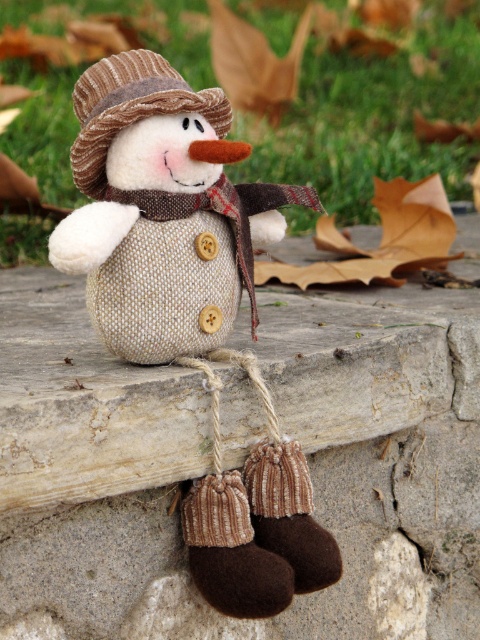
Question: Which point is closer to the camera taking this photo?

Choices:
 (A) (144, 81)
 (B) (462, 504)

Answer: (A)

Question: Which object is positioned closest to the burlap fabric snowman at center?

Choices:
 (A) burlap snowman at center
 (B) brown textured hat at center

Answer: (A)

Question: Which point is closer to the camera?

Choices:
 (A) (136, 113)
 (B) (349, 388)

Answer: (A)

Question: Does burlap fabric snowman at center appear under brown textured hat at center?

Choices:
 (A) no
 (B) yes

Answer: (B)

Question: From the image, what is the correct spatial relationship of burlap fabric snowman at center in relation to burlap snowman at center?

Choices:
 (A) below
 (B) above

Answer: (B)

Question: Is burlap fabric snowman at center wider than burlap snowman at center?

Choices:
 (A) yes
 (B) no

Answer: (A)